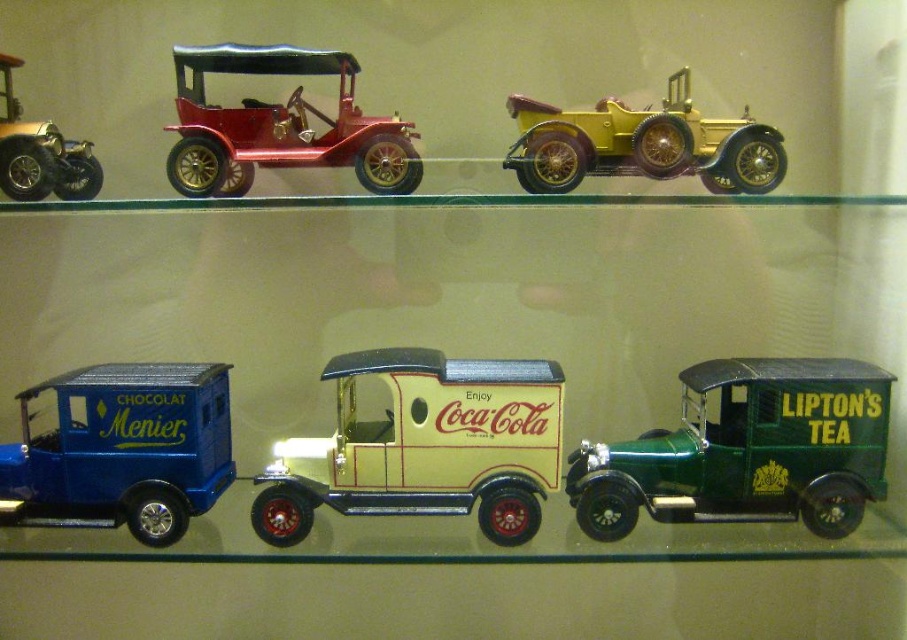
Question: Is metallic gold coca-cola delivery truck at center to the right of shiny red car at center from the viewer's perspective?

Choices:
 (A) no
 (B) yes

Answer: (B)

Question: Does shiny red car at center have a lesser width compared to shiny gold car at upper left?

Choices:
 (A) yes
 (B) no

Answer: (B)

Question: Is metallic gold coca-cola delivery truck at center further to the viewer compared to metallic blue van at lower left?

Choices:
 (A) no
 (B) yes

Answer: (A)

Question: Estimate the real-world distances between objects in this image. Which object is closer to the gold polished wood car at upper center?

Choices:
 (A) metallic gold coca-cola delivery truck at center
 (B) shiny gold car at upper left

Answer: (A)

Question: Which of the following is the farthest from the observer?

Choices:
 (A) (70, 424)
 (B) (530, 532)

Answer: (A)

Question: Which of these objects is positioned closest to the metallic blue van at lower left?

Choices:
 (A) shiny red car at center
 (B) gold polished wood car at upper center
 (C) metallic gold coca-cola delivery truck at center

Answer: (C)